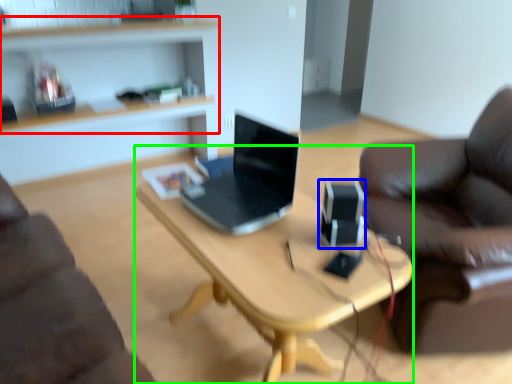
Question: Estimate the real-world distances between objects in this image. Which object is closer to shelf (highlighted by a red box), speaker (highlighted by a blue box) or desk (highlighted by a green box)?

Choices:
 (A) speaker
 (B) desk

Answer: (B)